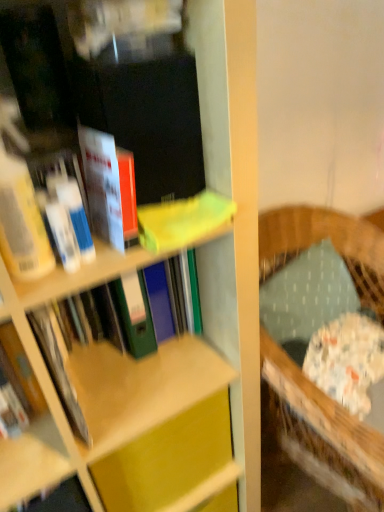
Question: From the image's perspective, does textured green pillow at right appear lower than matte yellow book at upper center, the second book positioned from the front?

Choices:
 (A) no
 (B) yes

Answer: (B)

Question: Does textured green pillow at right have a lesser width compared to matte yellow book at upper center, which is counted as the second book, starting from the back?

Choices:
 (A) yes
 (B) no

Answer: (B)

Question: From the image's perspective, is textured green pillow at right located above matte yellow book at upper center, which is counted as the second book, starting from the back?

Choices:
 (A) yes
 (B) no

Answer: (B)

Question: Does textured green pillow at right have a greater width compared to matte yellow book at upper center, which is counted as the second book, starting from the back?

Choices:
 (A) no
 (B) yes

Answer: (B)

Question: Can you confirm if textured green pillow at right is taller than matte yellow book at upper center, which is counted as the second book, starting from the back?

Choices:
 (A) no
 (B) yes

Answer: (B)

Question: Would you say wooden rocking chair at right is to the left or to the right of matte yellow book at upper center, which is counted as the second book, starting from the back, in the picture?

Choices:
 (A) right
 (B) left

Answer: (A)

Question: From a real-world perspective, relative to matte yellow book at upper center, the second book positioned from the front, is wooden rocking chair at right vertically above or below?

Choices:
 (A) below
 (B) above

Answer: (A)

Question: In terms of height, does wooden rocking chair at right look taller or shorter compared to matte yellow book at upper center, the second book positioned from the front?

Choices:
 (A) tall
 (B) short

Answer: (A)

Question: Considering the positions of wooden rocking chair at right and matte yellow book at upper center, which is counted as the second book, starting from the back, in the image, is wooden rocking chair at right bigger or smaller than matte yellow book at upper center, which is counted as the second book, starting from the back,?

Choices:
 (A) small
 (B) big

Answer: (B)

Question: Considering the positions of matte yellow book at upper center, the second book positioned from the front, and textured green pillow at right in the image, is matte yellow book at upper center, the second book positioned from the front, taller or shorter than textured green pillow at right?

Choices:
 (A) short
 (B) tall

Answer: (A)

Question: Looking at the image, does matte yellow book at upper center, which is counted as the second book, starting from the back, seem bigger or smaller compared to textured green pillow at right?

Choices:
 (A) big
 (B) small

Answer: (B)

Question: Relative to textured green pillow at right, is matte yellow book at upper center, which is counted as the second book, starting from the back, in front or behind?

Choices:
 (A) behind
 (B) front

Answer: (B)

Question: Visually, is matte yellow book at upper center, which is counted as the second book, starting from the back, positioned to the left or to the right of textured green pillow at right?

Choices:
 (A) left
 (B) right

Answer: (A)

Question: Considering the relative positions of matte plastic book at upper left, the 1th book from the front, and matte green folder at center, the third book viewed from the front, in the image provided, is matte plastic book at upper left, the 1th book from the front, to the left or to the right of matte green folder at center, the third book viewed from the front,?

Choices:
 (A) left
 (B) right

Answer: (B)

Question: Which is correct: matte plastic book at upper left, the 1th book from the front, is inside matte green folder at center, positioned as the 1th book in back-to-front order, or outside of it?

Choices:
 (A) inside
 (B) outside

Answer: (B)